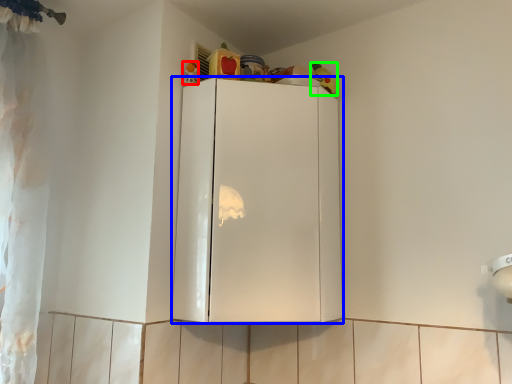
Question: Based on their relative distances, which object is farther from toy (highlighted by a red box)? Choose from cabinetry (highlighted by a blue box) and toy (highlighted by a green box).

Choices:
 (A) cabinetry
 (B) toy

Answer: (A)